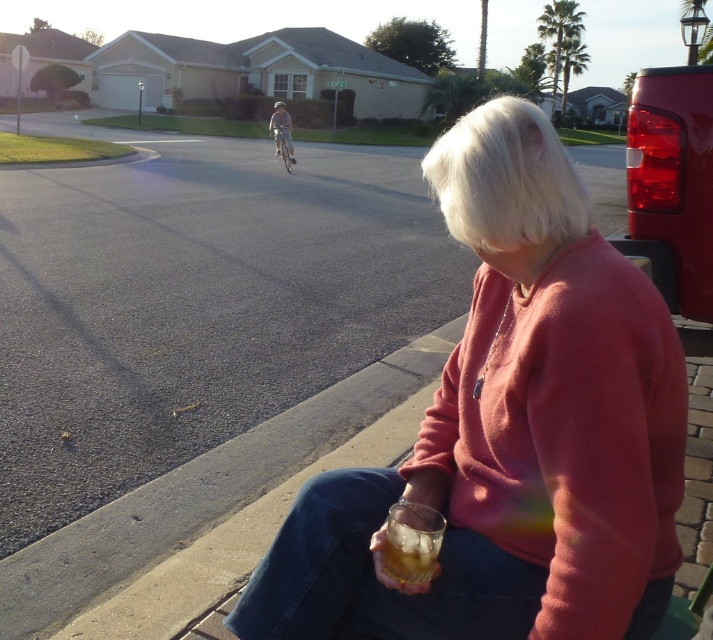
Is point (309, 582) positioned before point (426, 548)?

No, it is not.

Between pink matte sweater at lower right and translucent glass at lower center, which one is positioned higher?

pink matte sweater at lower right is above.

Who is more forward, (448, 422) or (394, 580)?

Point (394, 580) is in front.

The width and height of the screenshot is (713, 640). What are the coordinates of `pink matte sweater at lower right` in the screenshot? It's located at (508, 433).